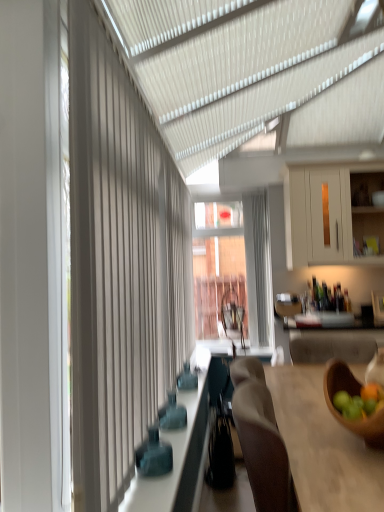
What do you see at coordinates (351, 395) in the screenshot? I see `wooden bowl at lower right` at bounding box center [351, 395].

What do you see at coordinates (323, 445) in the screenshot? I see `wooden table at right` at bounding box center [323, 445].

This screenshot has width=384, height=512. Identify the location of white textured curtain at left. (120, 267).

Is wooden table at right closer to the viewer compared to wooden bowl at lower right?

Yes, wooden table at right is in front of wooden bowl at lower right.

Which object is positioned more to the left, wooden table at right or wooden bowl at lower right?

From the viewer's perspective, wooden bowl at lower right appears more on the left side.

Is point (274, 407) more distant than point (328, 380)?

Yes, point (274, 407) is behind point (328, 380).

How different are the orientations of wooden table at right and wooden bowl at lower right in degrees?

There is a 0.246-degree angle between the facing directions of wooden table at right and wooden bowl at lower right.

Is point (138, 406) farther from viewer compared to point (194, 411)?

No, it is not.

Is matte blue glass bottles at center at the back of white textured curtain at left?

No, white textured curtain at left is not facing away from matte blue glass bottles at center.

From a real-world perspective, which object rests below the other?

From a 3D spatial view, matte blue glass bottles at center is below.

How different are the orientations of white matte cabinet at upper right and wooden bowl at lower right in degrees?

The facing directions of white matte cabinet at upper right and wooden bowl at lower right are 87.9 degrees apart.

Is wooden bowl at lower right at the back of white matte cabinet at upper right?

No, white matte cabinet at upper right is not facing away from wooden bowl at lower right.

Who is bigger, white matte cabinet at upper right or wooden bowl at lower right?

Bigger between the two is white matte cabinet at upper right.

In order to click on cabinetry behind the wooden bowl at lower right in this screenshot , I will do `click(317, 216)`.

Who is taller, white textured curtain at left or wooden bowl at lower right?

With more height is white textured curtain at left.

Could you tell me if white textured curtain at left is turned towards wooden bowl at lower right?

Yes, white textured curtain at left is oriented towards wooden bowl at lower right.

The height and width of the screenshot is (512, 384). I want to click on curtain lying above the wooden bowl at lower right (from the image's perspective), so click(120, 267).

Considering the positions of point (119, 494) and point (370, 437), is point (119, 494) closer or farther from the camera than point (370, 437)?

Point (119, 494).

Considering the relative positions of matte blue glass bottles at center and wooden table at right in the image provided, is matte blue glass bottles at center to the right of wooden table at right from the viewer's perspective?

Incorrect, matte blue glass bottles at center is not on the right side of wooden table at right.

In terms of height, does matte blue glass bottles at center look taller or shorter compared to wooden table at right?

Considering their sizes, matte blue glass bottles at center has less height than wooden table at right.

Considering the points (130, 490) and (338, 466), which point is behind, point (130, 490) or point (338, 466)?

The point (130, 490) is behind.

From a real-world perspective, does matte blue glass bottles at center stand above wooden table at right?

Correct, in the physical world, matte blue glass bottles at center is higher than wooden table at right.

Are wooden bowl at lower right and white matte cabinet at upper right located far from each other?

Indeed, wooden bowl at lower right is not near white matte cabinet at upper right.

Considering the sizes of wooden bowl at lower right and white matte cabinet at upper right in the image, is wooden bowl at lower right taller or shorter than white matte cabinet at upper right?

wooden bowl at lower right is shorter than white matte cabinet at upper right.

From the image's perspective, is wooden bowl at lower right located beneath white matte cabinet at upper right?

Indeed, from the image's perspective, wooden bowl at lower right is shown beneath white matte cabinet at upper right.

Is white matte cabinet at upper right at the left side of white textured curtain at left?

In fact, white matte cabinet at upper right is to the right of white textured curtain at left.

Is white matte cabinet at upper right bigger than white textured curtain at left?

Yes.

Would you consider white matte cabinet at upper right to be distant from white textured curtain at left?

Yes, white matte cabinet at upper right is far from white textured curtain at left.

Can you confirm if white matte cabinet at upper right is thinner than white textured curtain at left?

No, white matte cabinet at upper right is not thinner than white textured curtain at left.

Locate an element on the screen. The width and height of the screenshot is (384, 512). table that appears on the right of wooden bowl at lower right is located at coordinates (323, 445).

The width and height of the screenshot is (384, 512). What are the coordinates of `curtain above the matte blue glass bottles at center (from the image's perspective)` in the screenshot? It's located at (120, 267).

Which object lies nearer to the anchor point white textured curtain at left, matte blue glass bottles at center or wooden bowl at lower right?

The object closer to white textured curtain at left is matte blue glass bottles at center.

Which object lies nearer to the anchor point wooden table at right, wooden bowl at lower right or matte blue glass bottles at center?

Among the two, wooden bowl at lower right is located nearer to wooden table at right.

Estimate the real-world distances between objects in this image. Which object is closer to matte blue glass bottles at center, white matte cabinet at upper right or wooden table at right?

wooden table at right.

Which object lies nearer to the anchor point matte blue glass bottles at center, white textured curtain at left or white matte cabinet at upper right?

white textured curtain at left is positioned closer to the anchor matte blue glass bottles at center.

Based on their spatial positions, is white textured curtain at left or matte blue glass bottles at center further from wooden table at right?

white textured curtain at left is positioned further to the anchor wooden table at right.

Which object lies nearer to the anchor point white textured curtain at left, matte blue glass bottles at center or white matte cabinet at upper right?

Based on the image, matte blue glass bottles at center appears to be nearer to white textured curtain at left.

Considering their positions, is matte blue glass bottles at center positioned closer to white matte cabinet at upper right than wooden table at right?

Based on the image, matte blue glass bottles at center appears to be nearer to white matte cabinet at upper right.

Considering their positions, is matte blue glass bottles at center positioned closer to wooden bowl at lower right than white matte cabinet at upper right?

The object closer to wooden bowl at lower right is matte blue glass bottles at center.

Where is `counter top that lies between white textured curtain at left and wooden table at right from top to bottom`? This screenshot has height=512, width=384. counter top that lies between white textured curtain at left and wooden table at right from top to bottom is located at coordinates (179, 454).

At what (x,y) coordinates should I click in order to perform the action: click on curtain between wooden table at right and white matte cabinet at upper right along the z-axis. Please return your answer as a coordinate pair (x, y). Looking at the image, I should click on (120, 267).

Locate an element on the screen. counter top between wooden bowl at lower right and white matte cabinet at upper right in the front-back direction is located at coordinates (179, 454).

At what (x,y) coordinates should I click in order to perform the action: click on bowl located between wooden table at right and white matte cabinet at upper right in the depth direction. Please return your answer as a coordinate pair (x, y). This screenshot has width=384, height=512. Looking at the image, I should click on (351, 395).